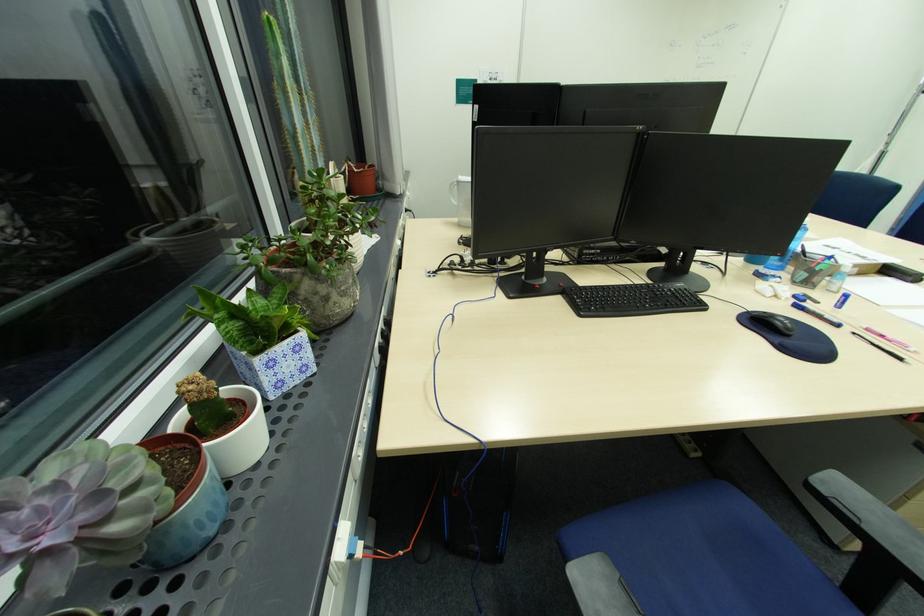
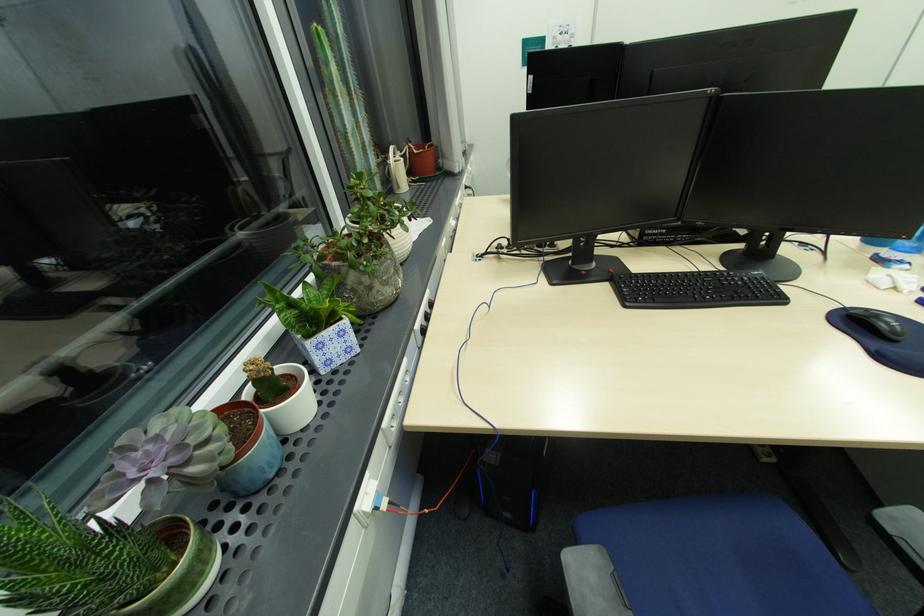
Find the pixel in the second image that matches [295,367] in the first image.

(341, 349)